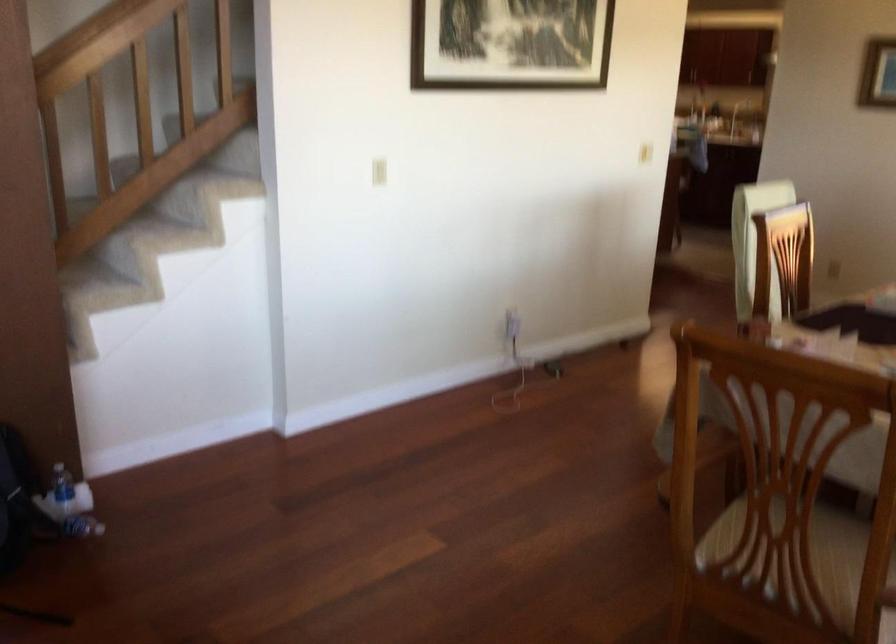
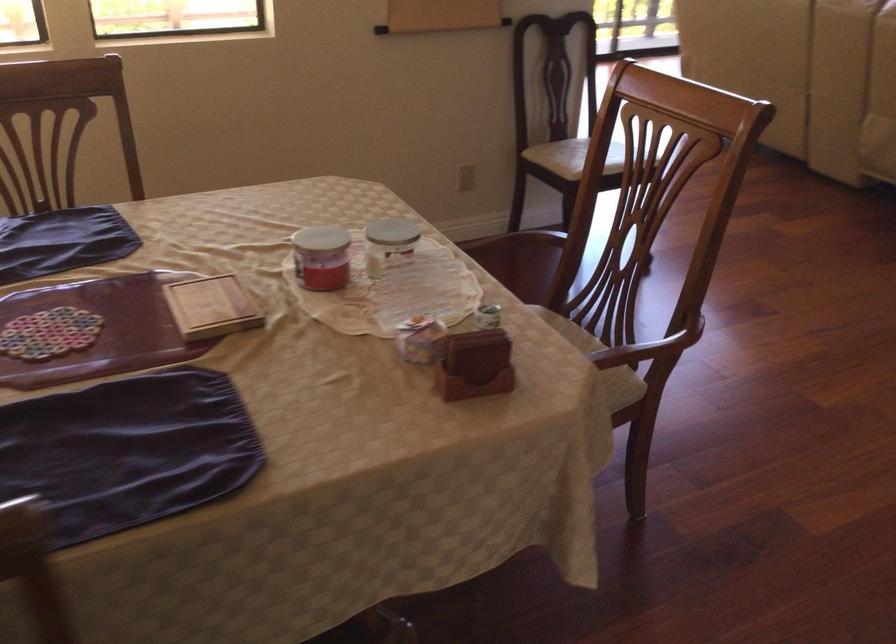
In the second image, find the point that corresponds to (747,327) in the first image.

(475, 365)